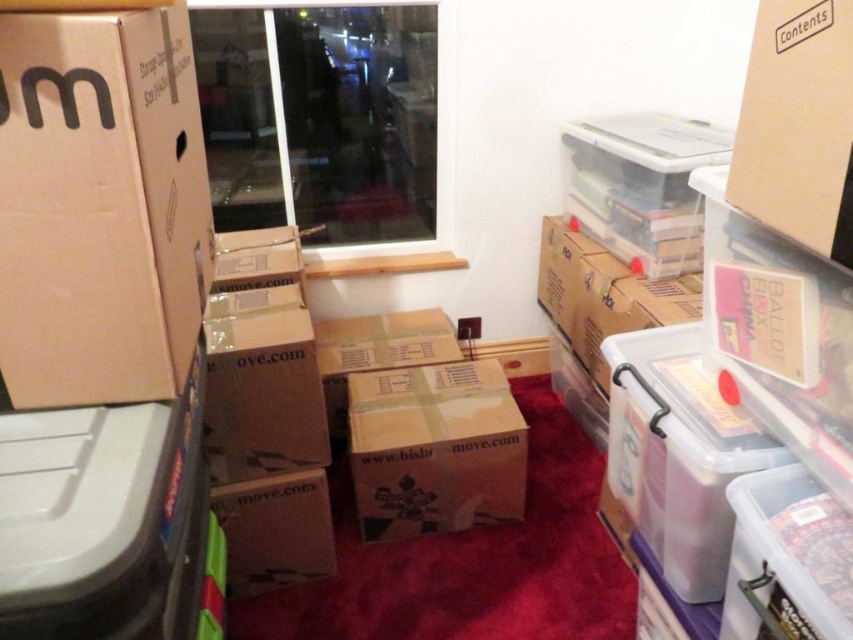
Is matte cardboard box at left thinner than brown cardboard box at center?

Correct, matte cardboard box at left's width is less than brown cardboard box at center's.

Where is `matte cardboard box at left`? The height and width of the screenshot is (640, 853). matte cardboard box at left is located at coordinates (99, 205).